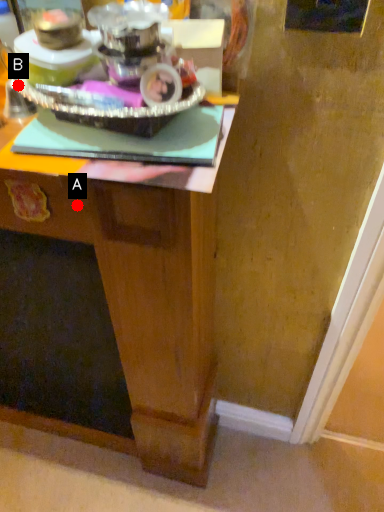
Question: Two points are circled on the image, labeled by A and B beside each circle. Among these points, which one is farthest from the camera?

Choices:
 (A) A is further
 (B) B is further

Answer: (A)